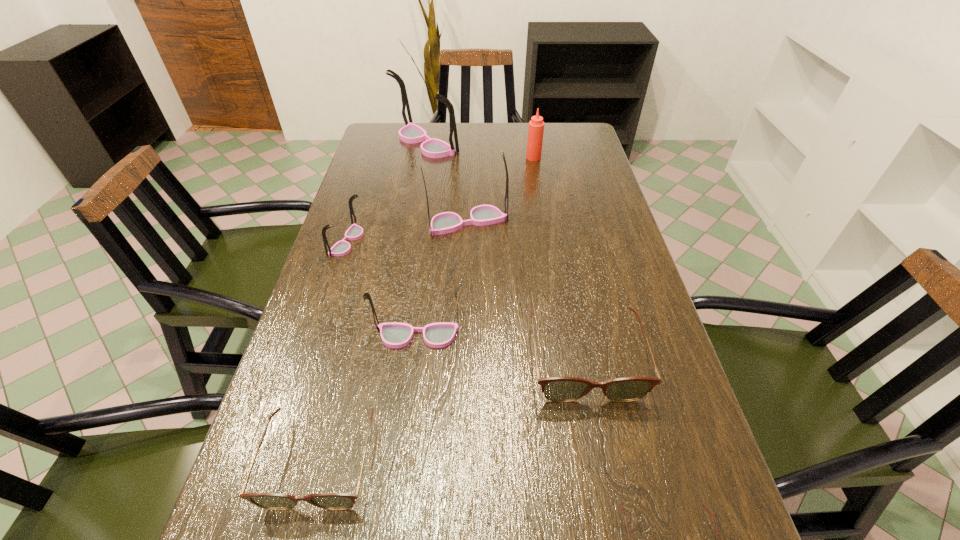
In order to click on brown spectacles that stands as the closest to the nearest pink spectacles in this screenshot , I will do `click(559, 389)`.

Where is `vacant space that satisfies the following two spatial constraints: 1. on the front side of the tallest spectacles; 2. on the left side of the Tabasco sauce`? vacant space that satisfies the following two spatial constraints: 1. on the front side of the tallest spectacles; 2. on the left side of the Tabasco sauce is located at coordinates (422, 158).